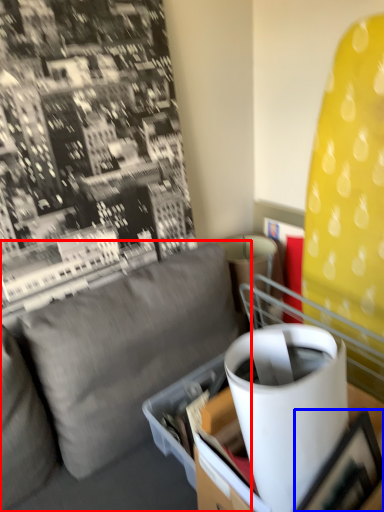
Question: Which point is further to the camera, studio couch (highlighted by a red box) or picture frame (highlighted by a blue box)?

Choices:
 (A) studio couch
 (B) picture frame

Answer: (B)